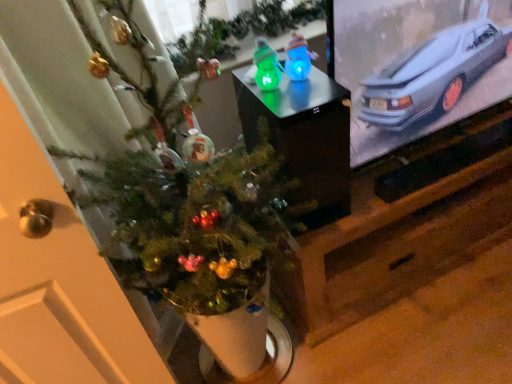
What is the approximate height of glossy plastic snowmen at center?

It is 15.86 inches.

Image resolution: width=512 pixels, height=384 pixels. What do you see at coordinates (304, 138) in the screenshot?
I see `glossy plastic snowmen at center` at bounding box center [304, 138].

Identify the location of green translucent toy at center, which is the 1th toy in left-to-right order. (266, 66).

What do you see at coordinates (190, 215) in the screenshot? The width and height of the screenshot is (512, 384). I see `green matte christmas tree at center` at bounding box center [190, 215].

Where is `glossy plastic snowmen at center`? glossy plastic snowmen at center is located at coordinates (304, 138).

Identify the location of furniture on the left of blue translucent snowman at center, placed as the 1th toy when sorted from right to left. (304, 138).

Is blue translucent snowman at center, placed as the second toy when sorted from left to right, not inside glossy plastic snowmen at center?

blue translucent snowman at center, placed as the second toy when sorted from left to right, is positioned outside glossy plastic snowmen at center.

Considering the sizes of blue translucent snowman at center, placed as the 1th toy when sorted from right to left, and glossy plastic snowmen at center in the image, is blue translucent snowman at center, placed as the 1th toy when sorted from right to left, wider or thinner than glossy plastic snowmen at center?

Considering their sizes, blue translucent snowman at center, placed as the 1th toy when sorted from right to left, looks slimmer than glossy plastic snowmen at center.

What's the angular difference between blue translucent snowman at center, placed as the second toy when sorted from left to right, and glossy plastic snowmen at center's facing directions?

They differ by 0.261 degrees in their facing directions.

Is glossy plastic snowmen at center not close to blue translucent snowman at center, placed as the 1th toy when sorted from right to left?

No, glossy plastic snowmen at center is not far away from blue translucent snowman at center, placed as the 1th toy when sorted from right to left.

Is glossy plastic snowmen at center oriented towards blue translucent snowman at center, placed as the 1th toy when sorted from right to left?

No, glossy plastic snowmen at center is not facing towards blue translucent snowman at center, placed as the 1th toy when sorted from right to left.

Is glossy plastic snowmen at center shorter than blue translucent snowman at center, placed as the second toy when sorted from left to right?

No, glossy plastic snowmen at center is not shorter than blue translucent snowman at center, placed as the second toy when sorted from left to right.

At what (x,y) coordinates should I click in order to perform the action: click on toy in front of the blue translucent snowman at center, placed as the second toy when sorted from left to right. Please return your answer as a coordinate pair (x, y). This screenshot has width=512, height=384. Looking at the image, I should click on (266, 66).

Is blue translucent snowman at center, placed as the second toy when sorted from left to right, facing away from green translucent toy at center, which is the 1th toy in left-to-right order?

blue translucent snowman at center, placed as the second toy when sorted from left to right, does not have its back to green translucent toy at center, which is the 1th toy in left-to-right order.

Can you confirm if blue translucent snowman at center, placed as the second toy when sorted from left to right, is smaller than green translucent toy at center, which is the 1th toy in left-to-right order?

No, blue translucent snowman at center, placed as the second toy when sorted from left to right, is not smaller than green translucent toy at center, which is the 1th toy in left-to-right order.

Looking at their sizes, would you say blue translucent snowman at center, placed as the second toy when sorted from left to right, is wider or thinner than green translucent toy at center, marked as the second toy in a right-to-left arrangement?

Considering their sizes, blue translucent snowman at center, placed as the second toy when sorted from left to right, looks slimmer than green translucent toy at center, marked as the second toy in a right-to-left arrangement.

Considering the positions of objects green matte christmas tree at center and green translucent toy at center, marked as the second toy in a right-to-left arrangement, in the image provided, who is more to the right, green matte christmas tree at center or green translucent toy at center, marked as the second toy in a right-to-left arrangement,?

From the viewer's perspective, green translucent toy at center, marked as the second toy in a right-to-left arrangement, appears more on the right side.

From a real-world perspective, does green matte christmas tree at center sit lower than green translucent toy at center, marked as the second toy in a right-to-left arrangement?

Yes, from a real-world perspective, green matte christmas tree at center is below green translucent toy at center, marked as the second toy in a right-to-left arrangement.

Measure the distance between green matte christmas tree at center and green translucent toy at center, which is the 1th toy in left-to-right order.

A distance of 42.00 centimeters exists between green matte christmas tree at center and green translucent toy at center, which is the 1th toy in left-to-right order.

Does point (189, 286) appear closer or farther from the camera than point (268, 66)?

Point (189, 286).

From the image's perspective, between glossy plastic snowmen at center and green translucent toy at center, which is the 1th toy in left-to-right order, which one is located above?

green translucent toy at center, which is the 1th toy in left-to-right order, from the image's perspective.

Is glossy plastic snowmen at center aimed at green translucent toy at center, which is the 1th toy in left-to-right order?

No, glossy plastic snowmen at center is not aimed at green translucent toy at center, which is the 1th toy in left-to-right order.

Where is `toy on the left side of glossy plastic snowmen at center`? toy on the left side of glossy plastic snowmen at center is located at coordinates (266, 66).

In the scene shown: Are glossy plastic snowmen at center and green translucent toy at center, marked as the second toy in a right-to-left arrangement, far apart?

glossy plastic snowmen at center is near green translucent toy at center, marked as the second toy in a right-to-left arrangement, not far away.

Which of these two, green translucent toy at center, marked as the second toy in a right-to-left arrangement, or glossy plastic snowmen at center, stands taller?

glossy plastic snowmen at center is taller.

Can you confirm if green translucent toy at center, marked as the second toy in a right-to-left arrangement, is smaller than glossy plastic snowmen at center?

Yes, green translucent toy at center, marked as the second toy in a right-to-left arrangement, is smaller than glossy plastic snowmen at center.

Looking at this image, which object is closer to the camera, green translucent toy at center, which is the 1th toy in left-to-right order, or glossy plastic snowmen at center?

Positioned in front is glossy plastic snowmen at center.

Is green translucent toy at center, marked as the second toy in a right-to-left arrangement, in front of or behind blue translucent snowman at center, placed as the 1th toy when sorted from right to left, in the image?

Visually, green translucent toy at center, marked as the second toy in a right-to-left arrangement, is located in front of blue translucent snowman at center, placed as the 1th toy when sorted from right to left.

From the image's perspective, which object appears higher, green translucent toy at center, marked as the second toy in a right-to-left arrangement, or blue translucent snowman at center, placed as the 1th toy when sorted from right to left?

blue translucent snowman at center, placed as the 1th toy when sorted from right to left, appears higher in the image.

Considering the points (275, 57) and (287, 52), which point is behind, point (275, 57) or point (287, 52)?

The point (287, 52) is behind.

From a real-world perspective, is green translucent toy at center, which is the 1th toy in left-to-right order, located higher than blue translucent snowman at center, placed as the 1th toy when sorted from right to left?

Correct, in the physical world, green translucent toy at center, which is the 1th toy in left-to-right order, is higher than blue translucent snowman at center, placed as the 1th toy when sorted from right to left.

Locate an element on the screen. The height and width of the screenshot is (384, 512). furniture below the blue translucent snowman at center, placed as the second toy when sorted from left to right (from a real-world perspective) is located at coordinates (304, 138).

Identify the location of toy on the right of glossy plastic snowmen at center. (298, 58).

From the picture: Looking at the image, which one is located further to green matte christmas tree at center, green translucent toy at center, which is the 1th toy in left-to-right order, or glossy plastic snowmen at center?

Among the two, green translucent toy at center, which is the 1th toy in left-to-right order, is located further to green matte christmas tree at center.

When comparing their distances from green matte christmas tree at center, does glossy plastic snowmen at center or green translucent toy at center, which is the 1th toy in left-to-right order, seem closer?

glossy plastic snowmen at center.

Looking at the image, which one is located further to green translucent toy at center, which is the 1th toy in left-to-right order, glossy plastic snowmen at center or blue translucent snowman at center, placed as the 1th toy when sorted from right to left?

glossy plastic snowmen at center is positioned further to the anchor green translucent toy at center, which is the 1th toy in left-to-right order.

Based on their spatial positions, is blue translucent snowman at center, placed as the 1th toy when sorted from right to left, or green translucent toy at center, marked as the second toy in a right-to-left arrangement, closer to green matte christmas tree at center?

The object closer to green matte christmas tree at center is green translucent toy at center, marked as the second toy in a right-to-left arrangement.

Based on their spatial positions, is blue translucent snowman at center, placed as the 1th toy when sorted from right to left, or glossy plastic snowmen at center further from green translucent toy at center, which is the 1th toy in left-to-right order?

Based on the image, glossy plastic snowmen at center appears to be further to green translucent toy at center, which is the 1th toy in left-to-right order.

Estimate the real-world distances between objects in this image. Which object is further from glossy plastic snowmen at center, green matte christmas tree at center or blue translucent snowman at center, placed as the second toy when sorted from left to right?

green matte christmas tree at center is positioned further to the anchor glossy plastic snowmen at center.

Estimate the real-world distances between objects in this image. Which object is further from blue translucent snowman at center, placed as the second toy when sorted from left to right, glossy plastic snowmen at center or green translucent toy at center, marked as the second toy in a right-to-left arrangement?

glossy plastic snowmen at center.

From the image, which object appears to be farther from green matte christmas tree at center, blue translucent snowman at center, placed as the second toy when sorted from left to right, or glossy plastic snowmen at center?

blue translucent snowman at center, placed as the second toy when sorted from left to right, is further to green matte christmas tree at center.

You are a GUI agent. You are given a task and a screenshot of the screen. Output one action in this format:
    pyautogui.click(x=<x>, y=<y>)
    Task: Click on the toy between green matte christmas tree at center and blue translucent snowman at center, placed as the 1th toy when sorted from right to left, in the front-back direction
    
    Given the screenshot: What is the action you would take?
    pyautogui.click(x=266, y=66)

At what (x,y) coordinates should I click in order to perform the action: click on furniture between green matte christmas tree at center and blue translucent snowman at center, placed as the second toy when sorted from left to right, from front to back. Please return your answer as a coordinate pair (x, y). The image size is (512, 384). Looking at the image, I should click on coord(304,138).

Where is `furniture located between green matte christmas tree at center and green translucent toy at center, marked as the second toy in a right-to-left arrangement, in the depth direction`? furniture located between green matte christmas tree at center and green translucent toy at center, marked as the second toy in a right-to-left arrangement, in the depth direction is located at coordinates (304, 138).

Find the location of `toy between blue translucent snowman at center, placed as the second toy when sorted from left to right, and glossy plastic snowmen at center, in the vertical direction`. toy between blue translucent snowman at center, placed as the second toy when sorted from left to right, and glossy plastic snowmen at center, in the vertical direction is located at coordinates click(266, 66).